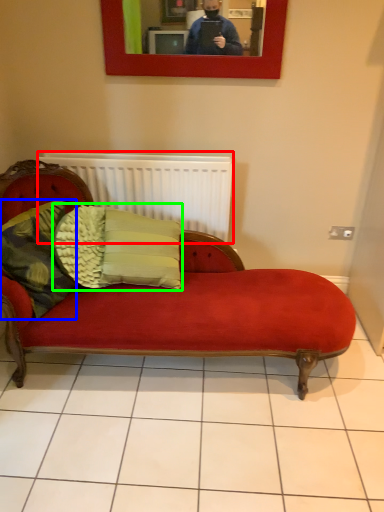
Question: Considering the real-world distances, which object is farthest from radiator (highlighted by a red box)? pillow (highlighted by a blue box) or pillow (highlighted by a green box)?

Choices:
 (A) pillow
 (B) pillow

Answer: (A)